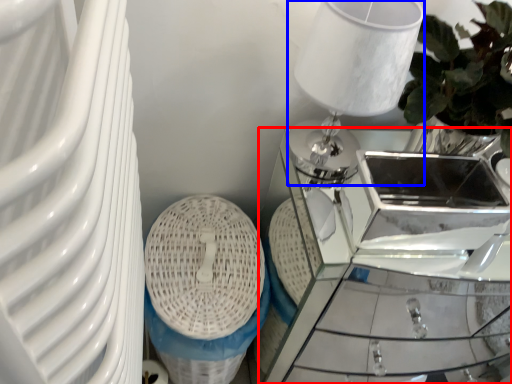
Question: Which point is closer to the camera, table (highlighted by a red box) or table lamp (highlighted by a blue box)?

Choices:
 (A) table
 (B) table lamp

Answer: (B)